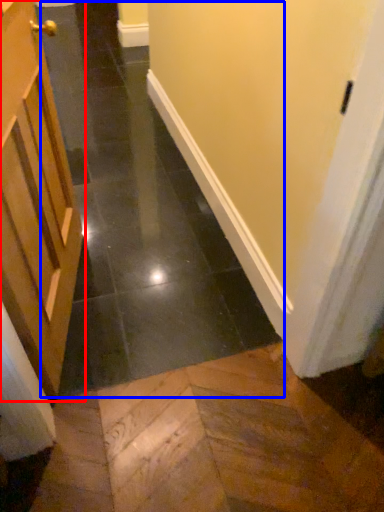
Question: Which point is closer to the camera, door (highlighted by a red box) or path (highlighted by a blue box)?

Choices:
 (A) door
 (B) path

Answer: (B)